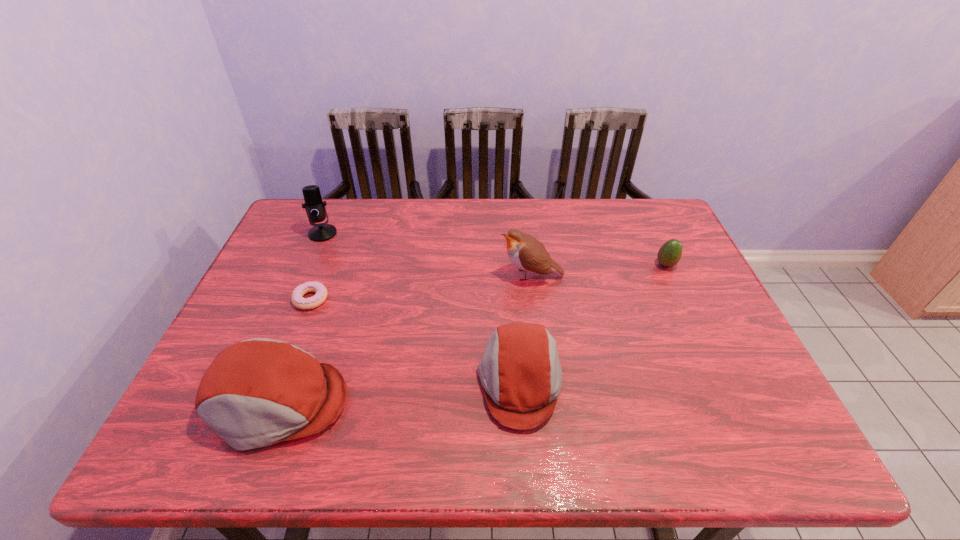
Where is `doughnut that is at the left edge`? doughnut that is at the left edge is located at coordinates (320, 296).

The image size is (960, 540). Identify the location of object positioned at the right edge. tap(669, 254).

What are the coordinates of `object located in the far left corner section of the desktop` in the screenshot? It's located at (315, 208).

At what (x,y) coordinates should I click in order to perform the action: click on object at the near left corner. Please return your answer as a coordinate pair (x, y). Looking at the image, I should click on (259, 392).

In the image, there is a desktop. Where is `free space at the far edge`? The width and height of the screenshot is (960, 540). free space at the far edge is located at coordinates (387, 214).

In the image, there is a desktop. Where is `vacant space at the near edge`? Image resolution: width=960 pixels, height=540 pixels. vacant space at the near edge is located at coordinates (400, 408).

Where is `vacant space at the left edge of the desktop`? The height and width of the screenshot is (540, 960). vacant space at the left edge of the desktop is located at coordinates (315, 258).

Image resolution: width=960 pixels, height=540 pixels. Find the location of `free spot at the right edge of the desktop`. free spot at the right edge of the desktop is located at coordinates (697, 265).

This screenshot has height=540, width=960. In the image, there is a desktop. Find the location of `vacant space at the far right corner`. vacant space at the far right corner is located at coordinates (649, 225).

You are a GUI agent. You are given a task and a screenshot of the screen. Output one action in this format:
    pyautogui.click(x=<x>, y=<y>)
    Task: Click on the unoccupied position between the left cap and the rightmost object
    The image size is (960, 540).
    Given the screenshot: What is the action you would take?
    pyautogui.click(x=472, y=334)